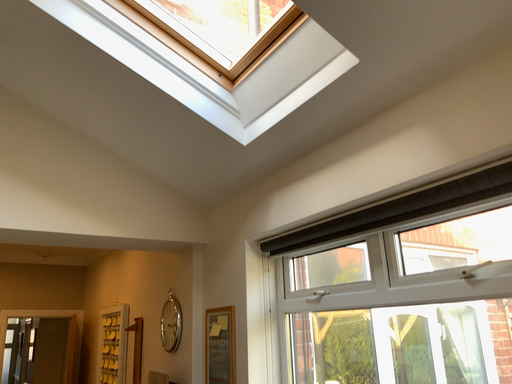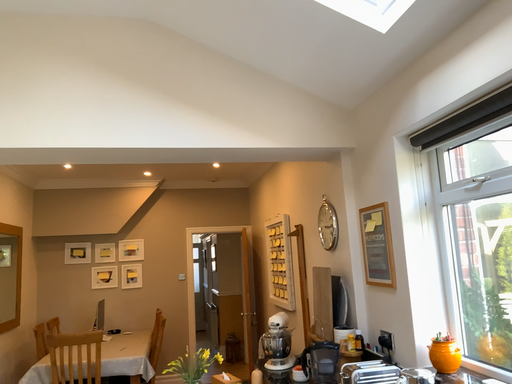
Question: How did the camera likely rotate when shooting the video?

Choices:
 (A) rotated left
 (B) rotated right

Answer: (A)